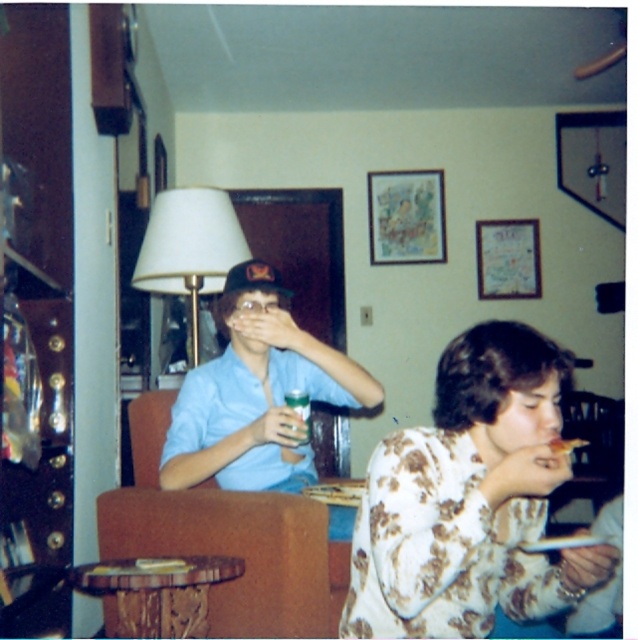
You are standing in the living room and want to walk from the point at coordinates point (517, 474) to the point at coordinates point (551, 440). Which direction should you move relative to the room?

You should move backward because point (517, 474) is in front of point (551, 440), so moving backward would take you toward the latter point.

You are a guest at a party and see the green glass beverage at center and the white paper plate at lower right on the table. Which item is closer to the left side of the table?

The green glass beverage at center is closer to the left side of the table than the white paper plate at lower right.

You are a photographer setting up a shoot in this living room. You need to ensure that the matte blue shirt at center and the white fabric lampshade at upper left are both visible in your photo. Given their sizes, which object should you position closer to the camera to maintain both in focus?

The matte blue shirt at center is much taller than the white fabric lampshade at upper left, so to maintain both in focus, position the matte blue shirt at center closer to the camera since it is larger and requires more emphasis in the frame.